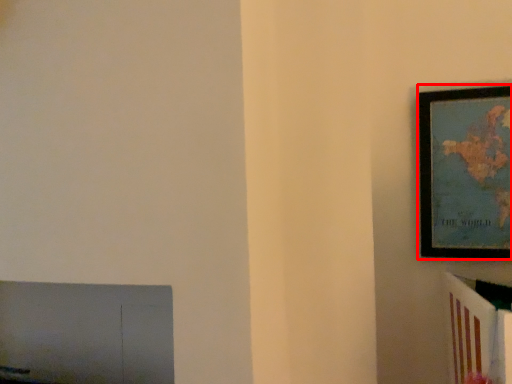
Question: From the image's perspective, what is the correct spatial relationship of picture frame (annotated by the red box) in relation to furniture?

Choices:
 (A) below
 (B) above

Answer: (B)